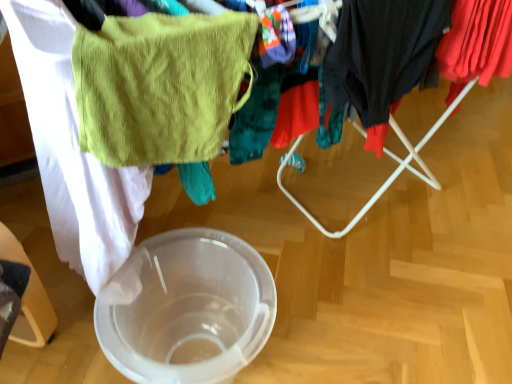
Question: Is red cotton shirt at upper right, arranged as the 2th clothing when viewed from the left, at the left side of dark gray fabric at right, the second clothing viewed from the right?

Choices:
 (A) yes
 (B) no

Answer: (B)

Question: Does red cotton shirt at upper right, arranged as the first clothing when viewed from the right, have a larger size compared to dark gray fabric at right, the second clothing viewed from the right?

Choices:
 (A) yes
 (B) no

Answer: (A)

Question: Is red cotton shirt at upper right, arranged as the 2th clothing when viewed from the left, to the right of dark gray fabric at right, the first clothing from the left, from the viewer's perspective?

Choices:
 (A) no
 (B) yes

Answer: (B)

Question: From the image's perspective, is red cotton shirt at upper right, arranged as the 2th clothing when viewed from the left, on dark gray fabric at right, the second clothing viewed from the right?

Choices:
 (A) yes
 (B) no

Answer: (A)

Question: Is red cotton shirt at upper right, arranged as the first clothing when viewed from the right, behind dark gray fabric at right, the second clothing viewed from the right?

Choices:
 (A) yes
 (B) no

Answer: (A)

Question: Is red cotton shirt at upper right, arranged as the 2th clothing when viewed from the left, oriented away from dark gray fabric at right, the first clothing from the left?

Choices:
 (A) no
 (B) yes

Answer: (A)

Question: From a real-world perspective, is dark gray fabric at right, the second clothing viewed from the right, on top of red cotton shirt at upper right, arranged as the 2th clothing when viewed from the left?

Choices:
 (A) no
 (B) yes

Answer: (B)

Question: Does dark gray fabric at right, the first clothing from the left, contain red cotton shirt at upper right, arranged as the 2th clothing when viewed from the left?

Choices:
 (A) no
 (B) yes

Answer: (A)

Question: From a real-world perspective, is dark gray fabric at right, the first clothing from the left, positioned under red cotton shirt at upper right, arranged as the 2th clothing when viewed from the left, based on gravity?

Choices:
 (A) yes
 (B) no

Answer: (B)

Question: Is dark gray fabric at right, the second clothing viewed from the right, at the left side of red cotton shirt at upper right, arranged as the first clothing when viewed from the right?

Choices:
 (A) yes
 (B) no

Answer: (A)

Question: Considering the relative sizes of dark gray fabric at right, the second clothing viewed from the right, and red cotton shirt at upper right, arranged as the 2th clothing when viewed from the left, in the image provided, is dark gray fabric at right, the second clothing viewed from the right, taller than red cotton shirt at upper right, arranged as the 2th clothing when viewed from the left,?

Choices:
 (A) yes
 (B) no

Answer: (A)

Question: Can you confirm if dark gray fabric at right, the first clothing from the left, is shorter than red cotton shirt at upper right, arranged as the 2th clothing when viewed from the left?

Choices:
 (A) yes
 (B) no

Answer: (B)

Question: Does transparent plastic bowl at center have a lesser width compared to green terry cloth towel at upper left?

Choices:
 (A) no
 (B) yes

Answer: (A)